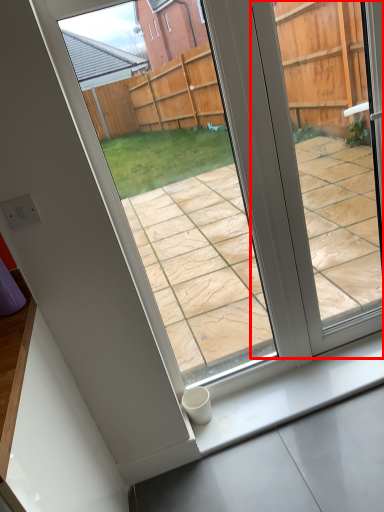
Question: In this image, where is window (annotated by the red box) located relative to window sill?

Choices:
 (A) right
 (B) left

Answer: (A)